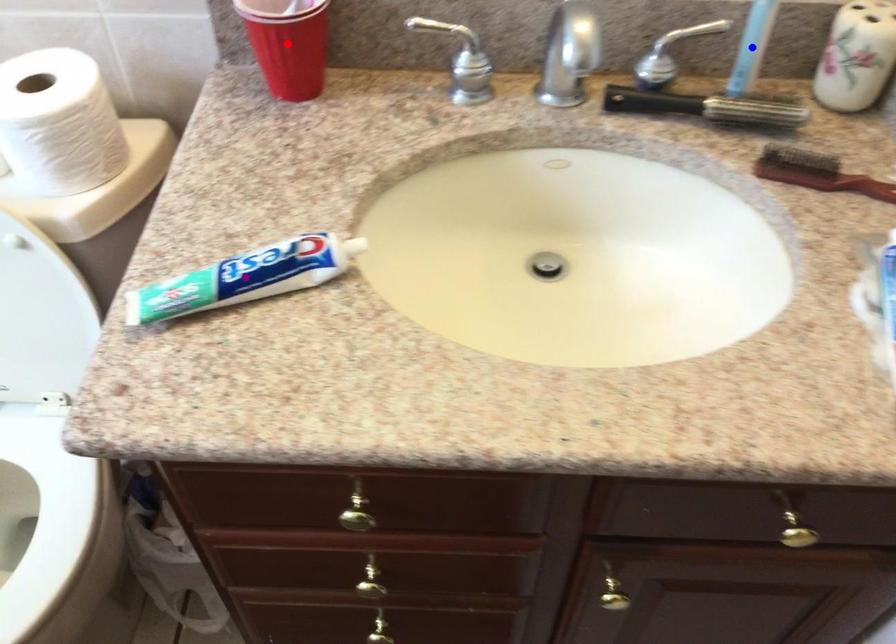
In the scene shown: Order these from nearest to farthest:
red point | blue point | purple point

red point < blue point < purple point